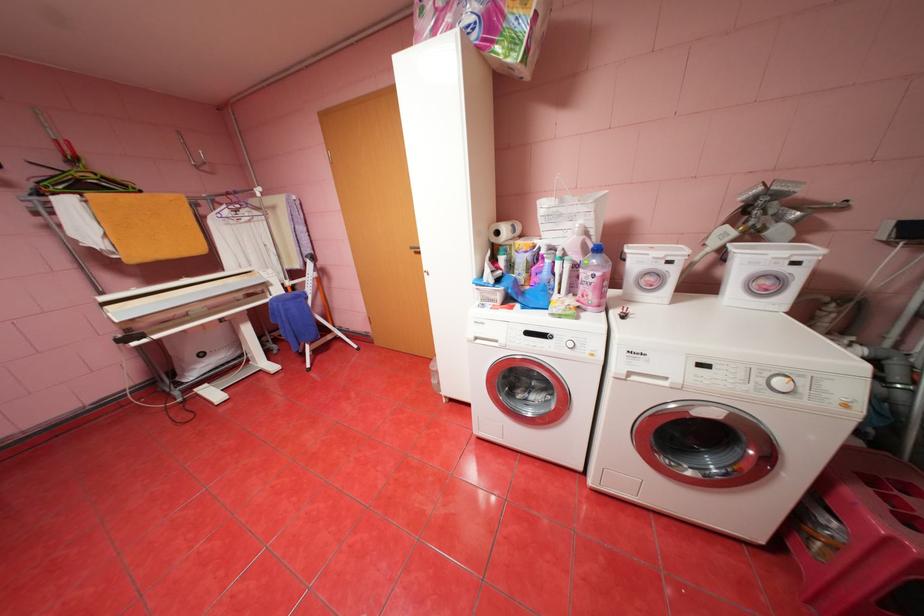
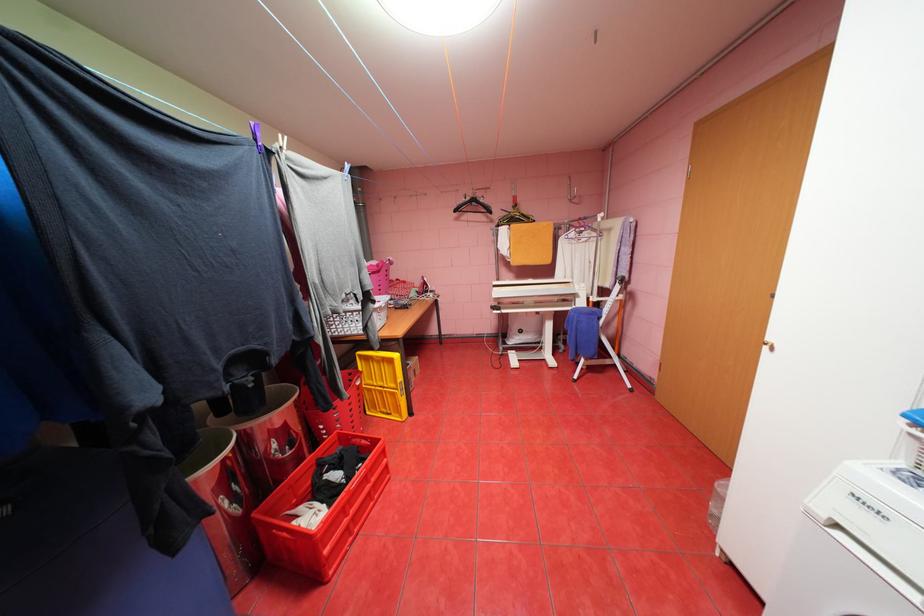
In the second image, find the point that corresponds to point 484,338 in the first image.

(845, 525)